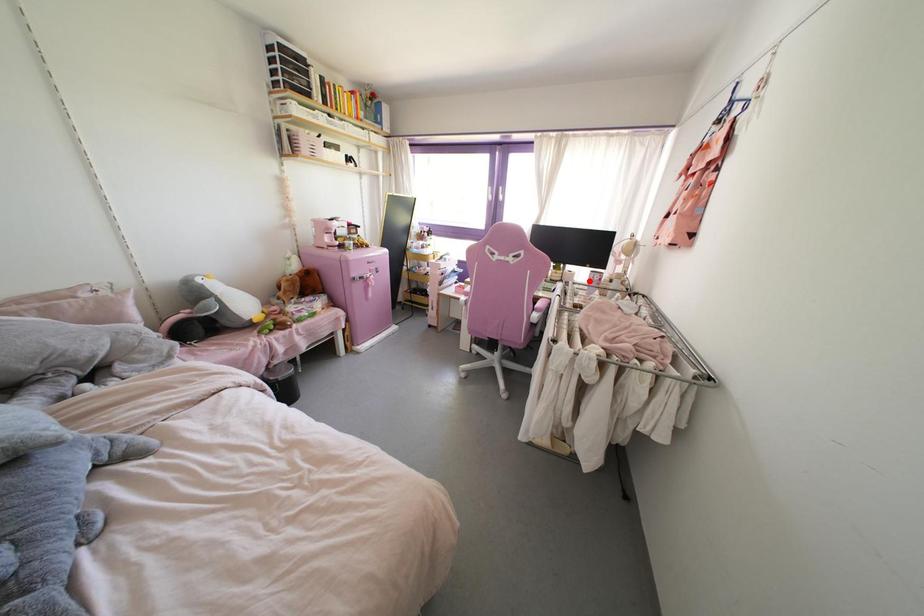
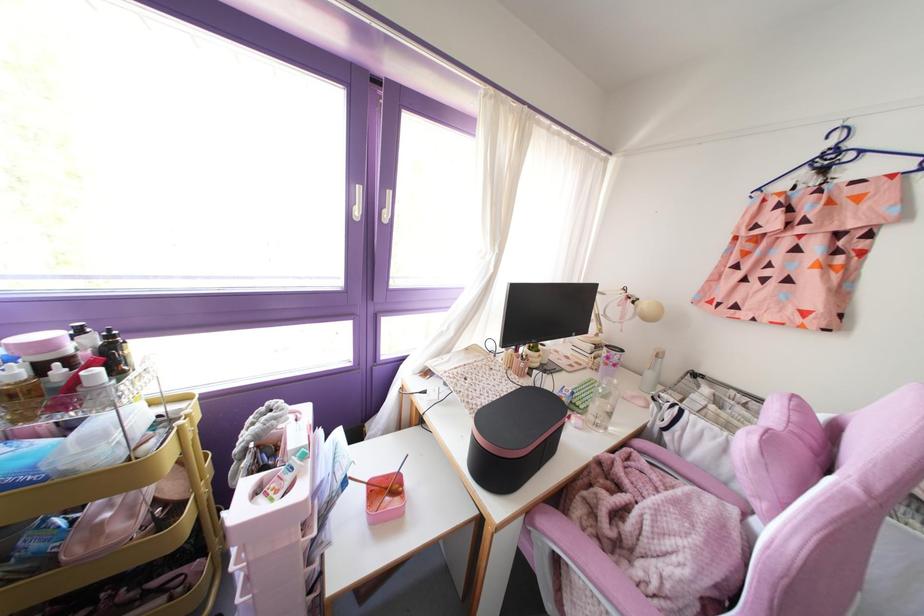
Question: I am providing you with two images of the same scene from different viewpoints. A red point is marked on the first image. Can you still see the location of the red point in image 2?

Choices:
 (A) Yes
 (B) No

Answer: (A)